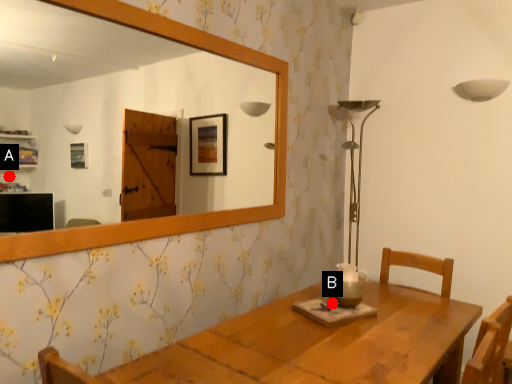
Question: Two points are circled on the image, labeled by A and B beside each circle. Which point appears farthest from the camera in this image?

Choices:
 (A) A is further
 (B) B is further

Answer: (A)